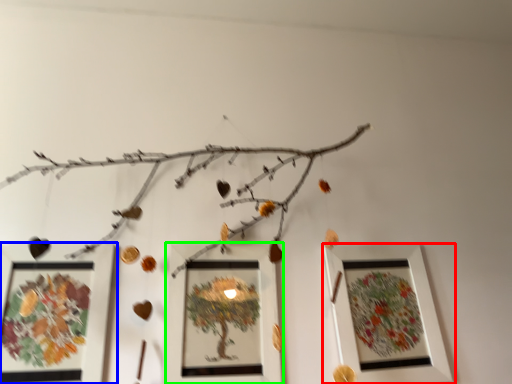
Question: Which is nearer to the picture frame (highlighted by a red box)? picture frame (highlighted by a blue box) or picture frame (highlighted by a green box).

Choices:
 (A) picture frame
 (B) picture frame

Answer: (B)